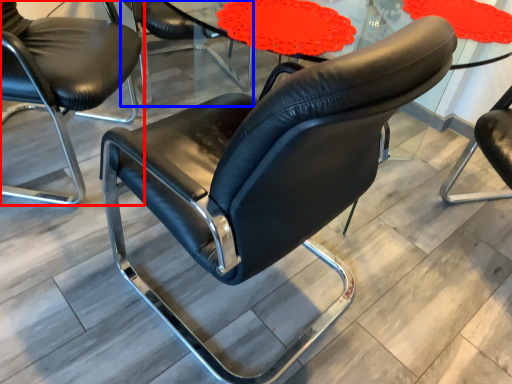
Question: Among these objects, which one is nearest to the camera, chair (highlighted by a red box) or chair (highlighted by a blue box)?

Choices:
 (A) chair
 (B) chair

Answer: (A)